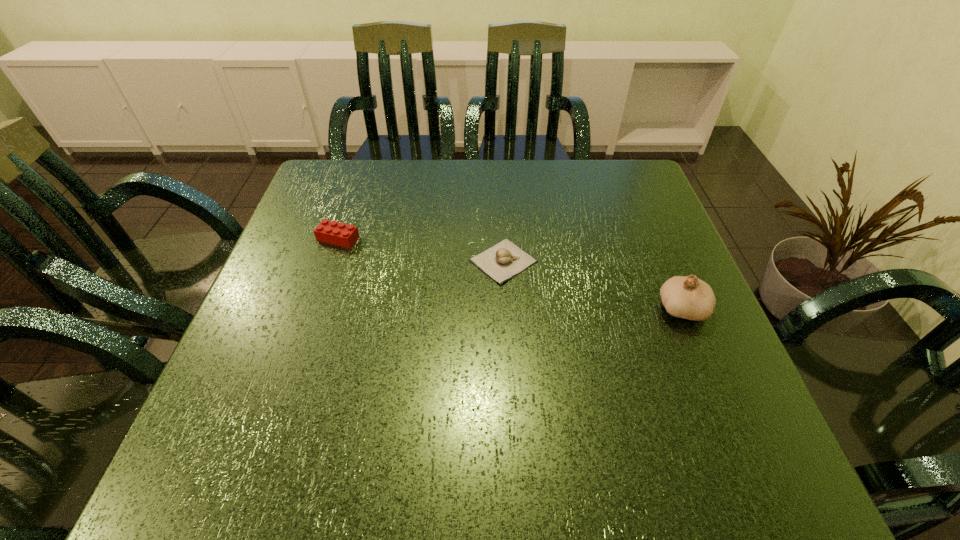
Find the location of a particular element. The width and height of the screenshot is (960, 540). the tallest object is located at coordinates (688, 297).

This screenshot has width=960, height=540. What are the coordinates of `the rightmost object` in the screenshot? It's located at (688, 297).

At what (x,y) coordinates should I click in order to perform the action: click on the second tallest object. Please return your answer as a coordinate pair (x, y). Image resolution: width=960 pixels, height=540 pixels. Looking at the image, I should click on (332, 232).

You are a GUI agent. You are given a task and a screenshot of the screen. Output one action in this format:
    pyautogui.click(x=<x>, y=<y>)
    Task: Click on the leftmost object
    
    Given the screenshot: What is the action you would take?
    pyautogui.click(x=332, y=232)

At what (x,y) coordinates should I click in order to perform the action: click on the shortest object. Please return your answer as a coordinate pair (x, y). The image size is (960, 540). Looking at the image, I should click on (x=502, y=261).

I want to click on the left garlic, so click(502, 261).

What are the coordinates of `free region located 0.110m on the left of the tallest object` in the screenshot? It's located at (601, 308).

Find the location of `free space located 0.360m on the front of the Lego`. free space located 0.360m on the front of the Lego is located at coordinates (288, 388).

Find the location of `vacant space located 0.300m on the front of the second object from left to right`. vacant space located 0.300m on the front of the second object from left to right is located at coordinates (512, 420).

Where is `object present at the left edge`? object present at the left edge is located at coordinates [332, 232].